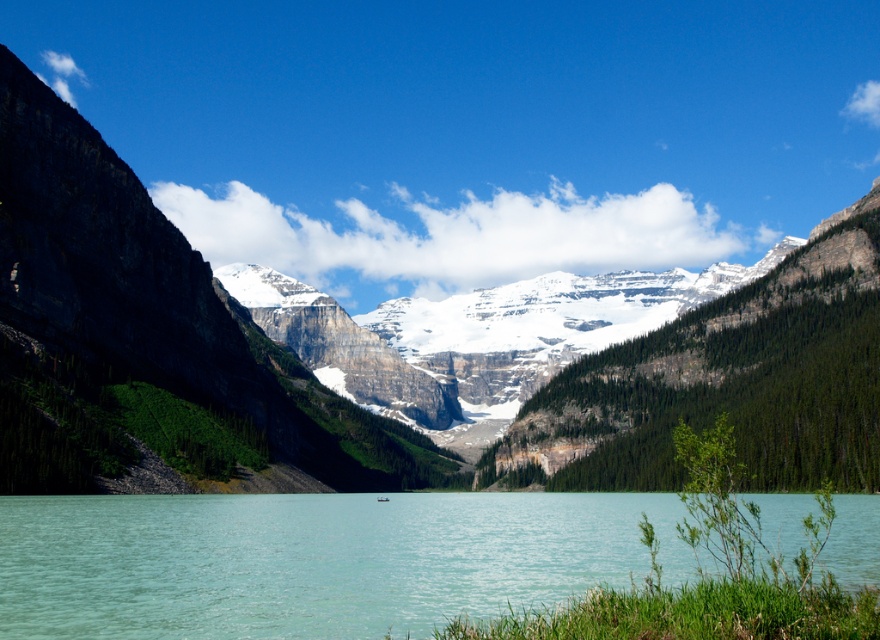
The height and width of the screenshot is (640, 880). What do you see at coordinates (462, 333) in the screenshot?
I see `green forested mountain at center` at bounding box center [462, 333].

Is green forested mountain at center taller than clear water at center?

Indeed, green forested mountain at center has a greater height compared to clear water at center.

Where is `green forested mountain at center`? The height and width of the screenshot is (640, 880). green forested mountain at center is located at coordinates (462, 333).